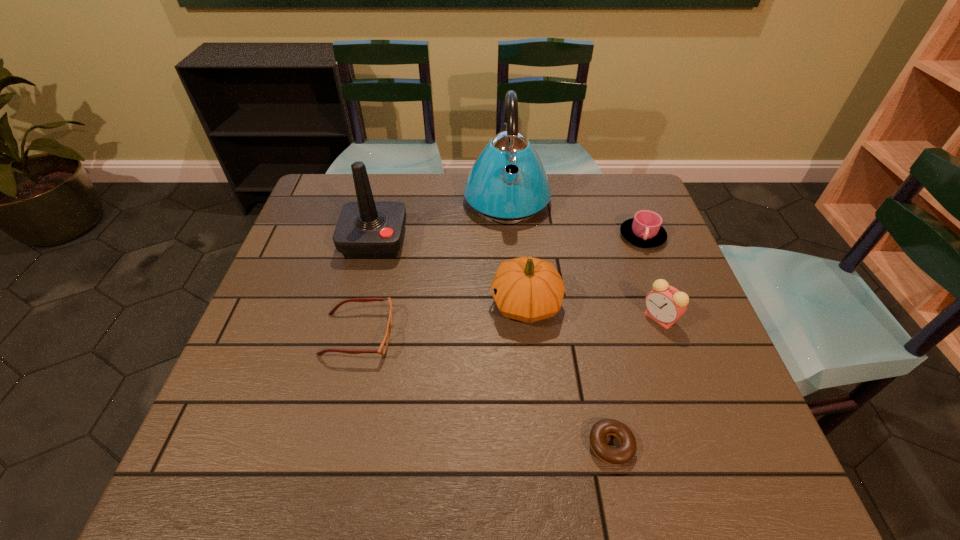
Where is `the tallest object`? The height and width of the screenshot is (540, 960). the tallest object is located at coordinates (494, 194).

Where is `joystick`? The width and height of the screenshot is (960, 540). joystick is located at coordinates pyautogui.click(x=365, y=229).

This screenshot has height=540, width=960. I want to click on gourd, so click(528, 289).

The width and height of the screenshot is (960, 540). In order to click on the fourth shortest object in this screenshot , I will do `click(665, 304)`.

What are the coordinates of `cup` in the screenshot? It's located at (644, 230).

Identify the location of the second shortest object. This screenshot has height=540, width=960. (382, 349).

Identify the location of the nearest object. The width and height of the screenshot is (960, 540). (625, 452).

The width and height of the screenshot is (960, 540). I want to click on doughnut, so point(625,452).

You are a GUI agent. You are given a task and a screenshot of the screen. Output one action in this format:
    pyautogui.click(x=<x>, y=<y>)
    Task: Click on the vacant space situated 0.140m at the spout of the kettle
    
    Given the screenshot: What is the action you would take?
    pyautogui.click(x=512, y=264)

Locate an element on the screen. Image resolution: width=960 pixels, height=540 pixels. vacant space located 0.060m on the right of the joystick is located at coordinates (427, 241).